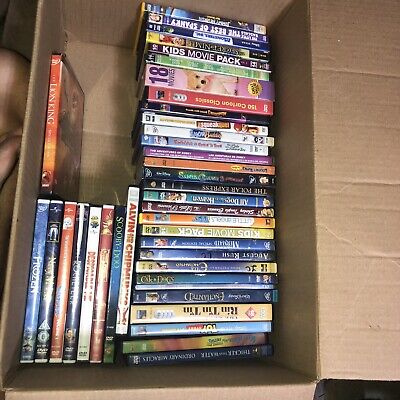
Locate an element on the screen. The height and width of the screenshot is (400, 400). dvd set is located at coordinates (176, 312), (182, 293), (212, 101), (216, 84).